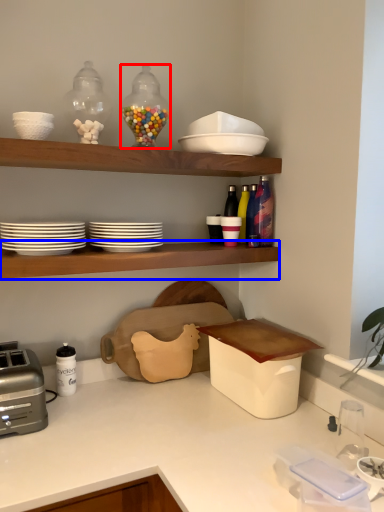
Question: Which object is further to the camera taking this photo, tableware (highlighted by a red box) or shelf (highlighted by a blue box)?

Choices:
 (A) tableware
 (B) shelf

Answer: (A)